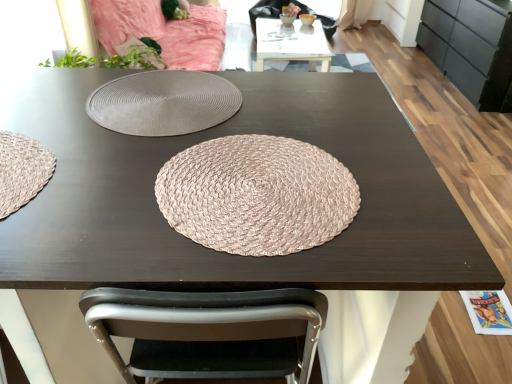
Image resolution: width=512 pixels, height=384 pixels. I want to click on free location above pink woven mat at center (from a real-world perspective), so click(x=248, y=207).